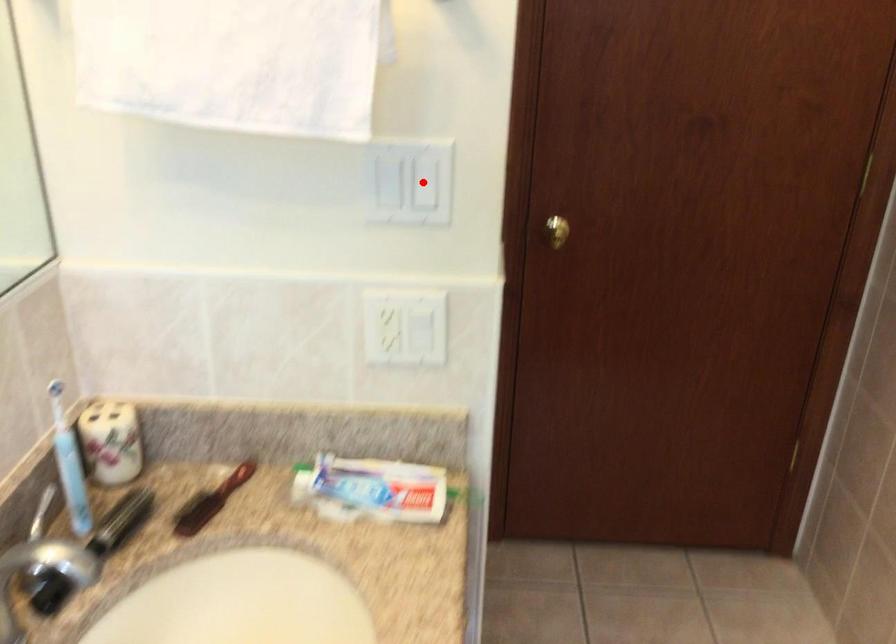
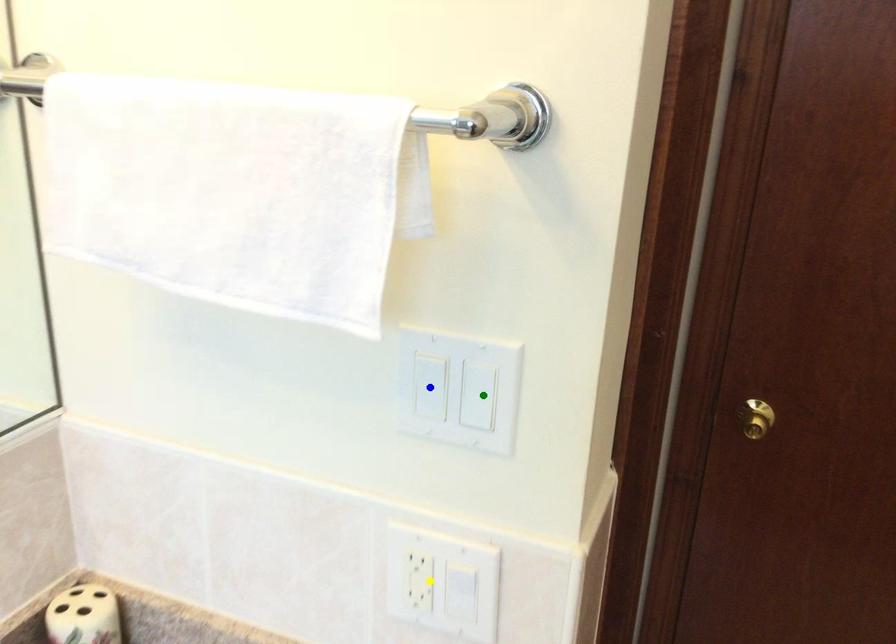
Question: I am providing you with two images of the same scene from different viewpoints. A red point is marked on the first image. You are given multiple points on the second image. Which mark in image 2 goes with the point in image 1?

Choices:
 (A) green point
 (B) blue point
 (C) yellow point

Answer: (A)